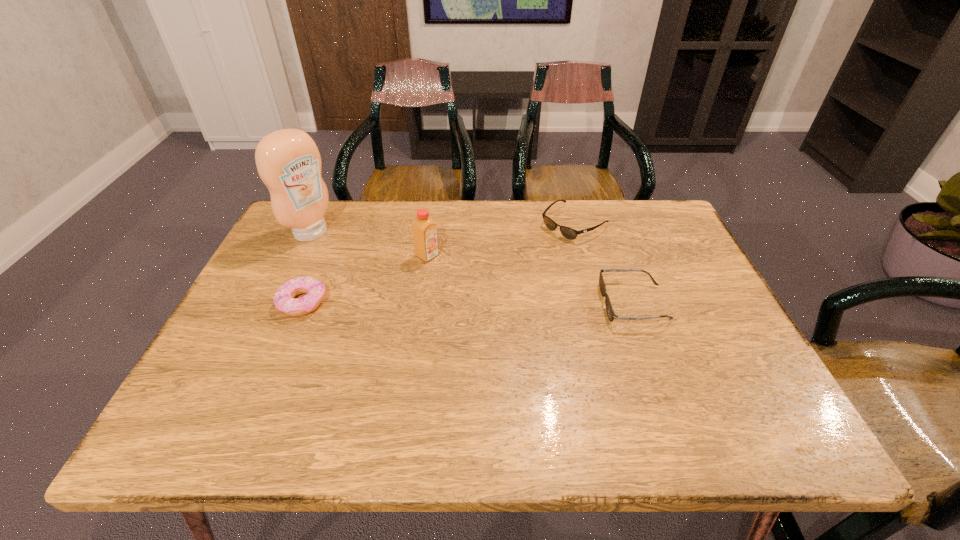
Find the location of a particular element. The image size is (960, 540). object that stands as the third closest to the tallest object is located at coordinates (569, 233).

The image size is (960, 540). I want to click on object that is the third closest to the doughnut, so click(x=569, y=233).

At what (x,y) coordinates should I click in order to perform the action: click on vacant space that satisfies the following two spatial constraints: 1. on the front side of the nearer sunglasses; 2. on the front-facing side of the farther sunglasses. Please return your answer as a coordinate pair (x, y). The image size is (960, 540). Looking at the image, I should click on (596, 303).

Find the location of a particular element. This screenshot has width=960, height=540. free space that satisfies the following two spatial constraints: 1. on the front side of the doughnut; 2. on the front-facing side of the nearer sunglasses is located at coordinates 302,303.

Where is `vacant point that satisfies the following two spatial constraints: 1. on the front side of the nearer sunglasses; 2. on the front-facing side of the farther sunglasses`? The image size is (960, 540). vacant point that satisfies the following two spatial constraints: 1. on the front side of the nearer sunglasses; 2. on the front-facing side of the farther sunglasses is located at coordinates (596, 303).

Locate an element on the screen. free space that satisfies the following two spatial constraints: 1. on the back side of the farther sunglasses; 2. on the right side of the fourth shortest object is located at coordinates (432, 223).

This screenshot has height=540, width=960. Find the location of `vacant space that satisfies the following two spatial constraints: 1. on the front side of the fourth shortest object; 2. on the front-facing side of the nearer sunglasses`. vacant space that satisfies the following two spatial constraints: 1. on the front side of the fourth shortest object; 2. on the front-facing side of the nearer sunglasses is located at coordinates (420, 303).

Where is `blank area in the image that satisfies the following two spatial constraints: 1. on the front side of the tallest object; 2. on the front-facing side of the nearer sunglasses`? The width and height of the screenshot is (960, 540). blank area in the image that satisfies the following two spatial constraints: 1. on the front side of the tallest object; 2. on the front-facing side of the nearer sunglasses is located at coordinates (277, 303).

Image resolution: width=960 pixels, height=540 pixels. I want to click on vacant position in the image that satisfies the following two spatial constraints: 1. on the back side of the condiment; 2. on the left side of the farther sunglasses, so click(316, 223).